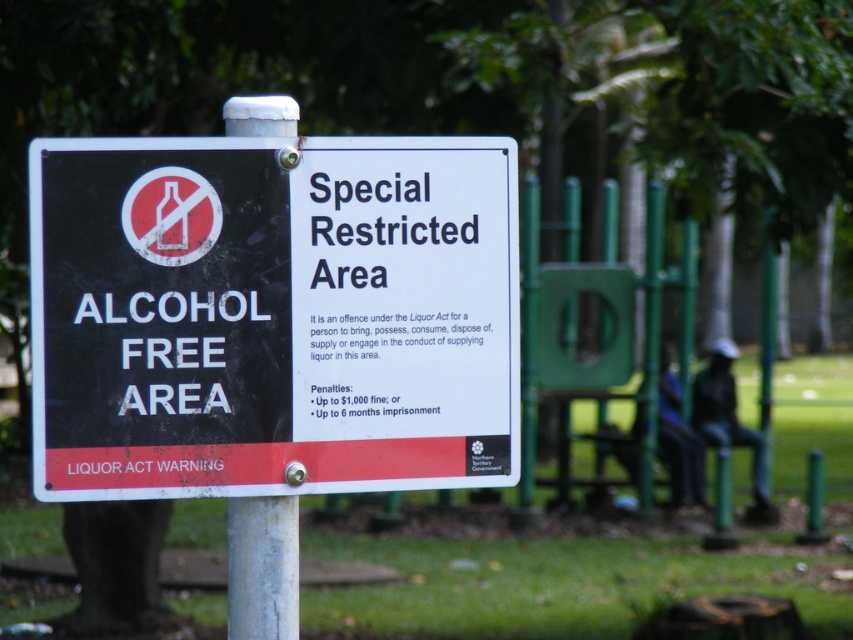
You are standing at the point closest to the signpost. Which point, point (170, 403) or point (286, 115), is closer to you?

Point (170, 403) is closer to you because it is in front of point (286, 115).

Based on the photo, you are a park visitor holding a 9 inch wide backpack. You want to place your backpack between the metallic signboard at center and the white metallic pole at center. Is there enough space for your backpack?

The metallic signboard at center is 8.97 inches away from the white metallic pole at center. Since your backpack is 9 inches wide, there isn not enough space to place it between them.

What are the coordinates of the metallic signboard at center?

The metallic signboard at center is located at point (271, 316).